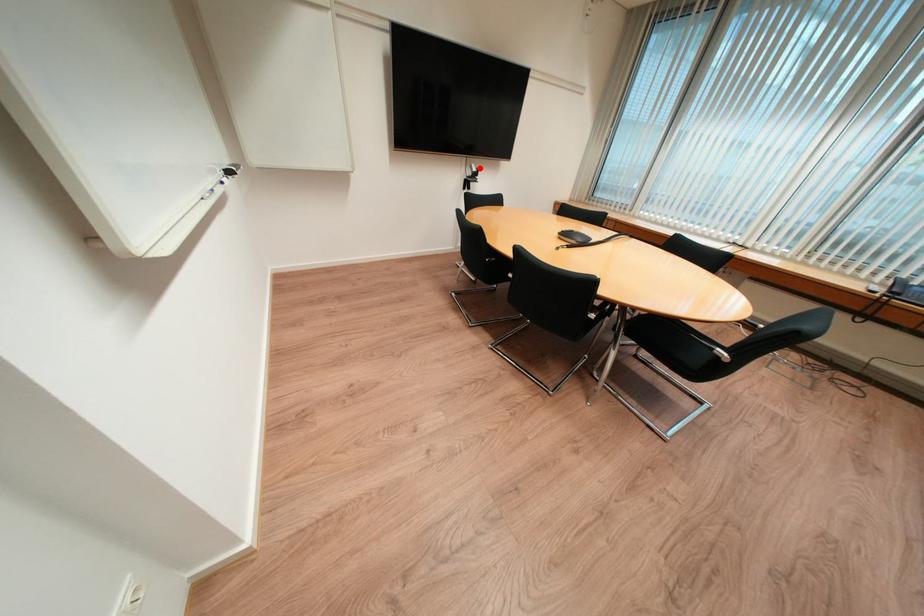
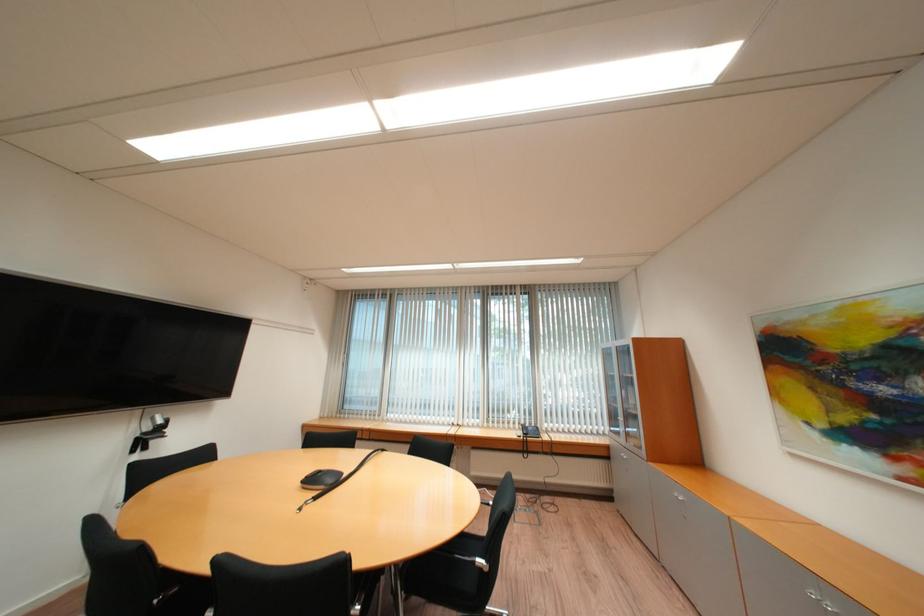
Locate, in the second image, the point that corresponds to the highlighted location in the first image.

(162, 419)